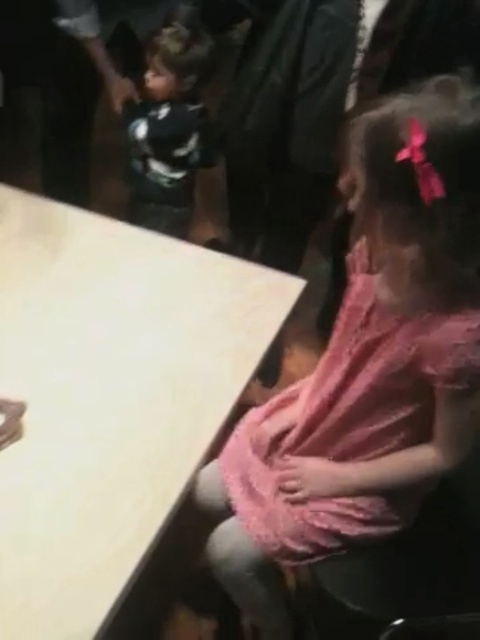
Between pink lace dress at lower right and black matte shirt at upper left, which one appears on the right side from the viewer's perspective?

Positioned to the right is pink lace dress at lower right.

Which of these two, pink lace dress at lower right or black matte shirt at upper left, stands shorter?

With less height is pink lace dress at lower right.

Between point (264, 403) and point (165, 51), which one is positioned behind?

The point (264, 403) is behind.

Locate an element on the screen. Image resolution: width=480 pixels, height=640 pixels. pink lace dress at lower right is located at coordinates (349, 420).

Measure the distance between white matte table at lower left and camera.

A distance of 32.76 inches exists between white matte table at lower left and camera.

Is white matte table at lower left thinner than pink lace dress at lower right?

In fact, white matte table at lower left might be wider than pink lace dress at lower right.

Does point (148, 296) lie in front of point (254, 432)?

Yes, it is in front of point (254, 432).

What are the coordinates of `white matte table at lower left` in the screenshot? It's located at (109, 396).

From the picture: Can you confirm if white matte table at lower left is wider than black matte shirt at upper left?

Yes.

The height and width of the screenshot is (640, 480). I want to click on white matte table at lower left, so click(x=109, y=396).

Identify the location of white matte table at lower left. This screenshot has height=640, width=480. (109, 396).